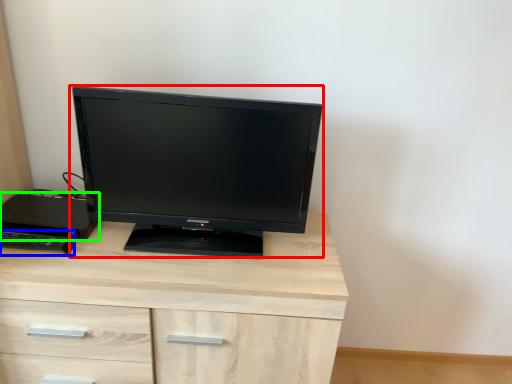
Question: Which is nearer to the computer monitor (highlighted by a red box)? desktop (highlighted by a blue box) or desktop (highlighted by a green box).

Choices:
 (A) desktop
 (B) desktop

Answer: (B)